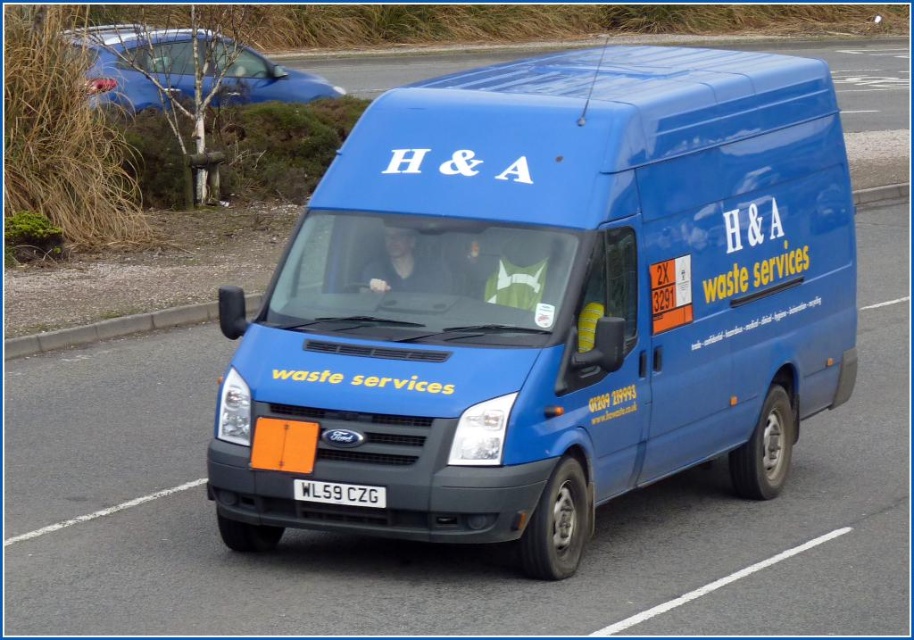
Does point (643, 237) come closer to viewer compared to point (359, 492)?

No, it is behind (359, 492).

Does matte blue van at center appear on the right side of white plastic license plate at center?

Indeed, matte blue van at center is positioned on the right side of white plastic license plate at center.

Is point (721, 420) positioned after point (379, 488)?

Yes, point (721, 420) is farther from viewer.

Locate an element on the screen. The image size is (914, 640). matte blue van at center is located at coordinates (547, 300).